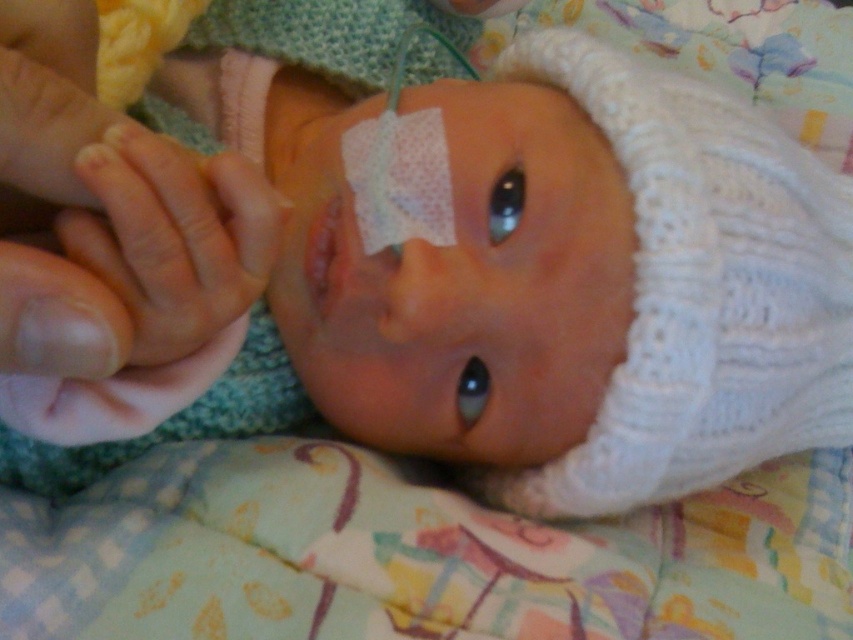
Question: Is matte plastic eye patch at center smaller than pale skin hand at left?

Choices:
 (A) yes
 (B) no

Answer: (B)

Question: Can you confirm if matte plastic eye patch at center is positioned to the left of pale skin hand at left?

Choices:
 (A) no
 (B) yes

Answer: (A)

Question: Is matte plastic eye patch at center wider than pale skin hand at left?

Choices:
 (A) no
 (B) yes

Answer: (B)

Question: Which of the following is the closest to the observer?

Choices:
 (A) (125, 248)
 (B) (444, 348)

Answer: (A)

Question: Which of the following is the farthest from the observer?

Choices:
 (A) (161, 352)
 (B) (618, 294)

Answer: (B)